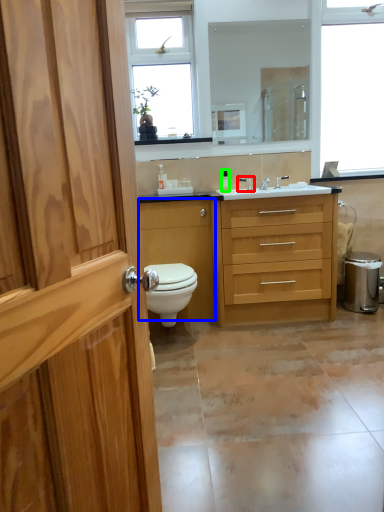
Question: Which object is the farthest from tap (highlighted by a red box)? Choose among these: cabinetry (highlighted by a blue box) or toiletry (highlighted by a green box).

Choices:
 (A) cabinetry
 (B) toiletry

Answer: (A)